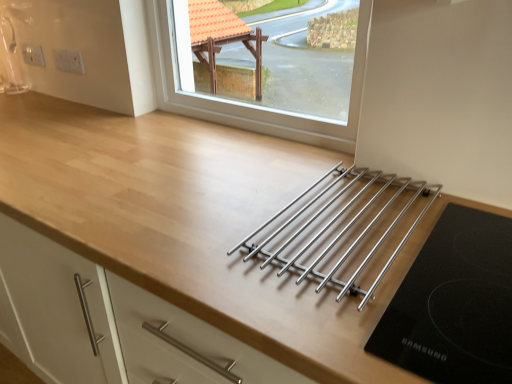
Question: Would you say white plastic electric outlet at upper left, placed as the first electric outlet when sorted from front to back, is inside or outside white plastic electrical outlet at upper left, arranged as the first electric outlet when viewed from the left?

Choices:
 (A) outside
 (B) inside

Answer: (A)

Question: Considering the positions of point (55, 64) and point (39, 46), is point (55, 64) closer or farther from the camera than point (39, 46)?

Choices:
 (A) closer
 (B) farther

Answer: (A)

Question: Estimate the real-world distances between objects in this image. Which object is closer to the white plastic electrical outlet at upper left, arranged as the second electric outlet when viewed from the right?

Choices:
 (A) clear glass window at upper center
 (B) white plastic electric outlet at upper left, placed as the first electric outlet when sorted from front to back
 (C) polished stainless steel rack at center

Answer: (B)

Question: Based on their relative distances, which object is farther from the white plastic electric outlet at upper left, the second electric outlet viewed from the left?

Choices:
 (A) clear glass window at upper center
 (B) polished stainless steel rack at center
 (C) white plastic electrical outlet at upper left, arranged as the first electric outlet when viewed from the left

Answer: (B)